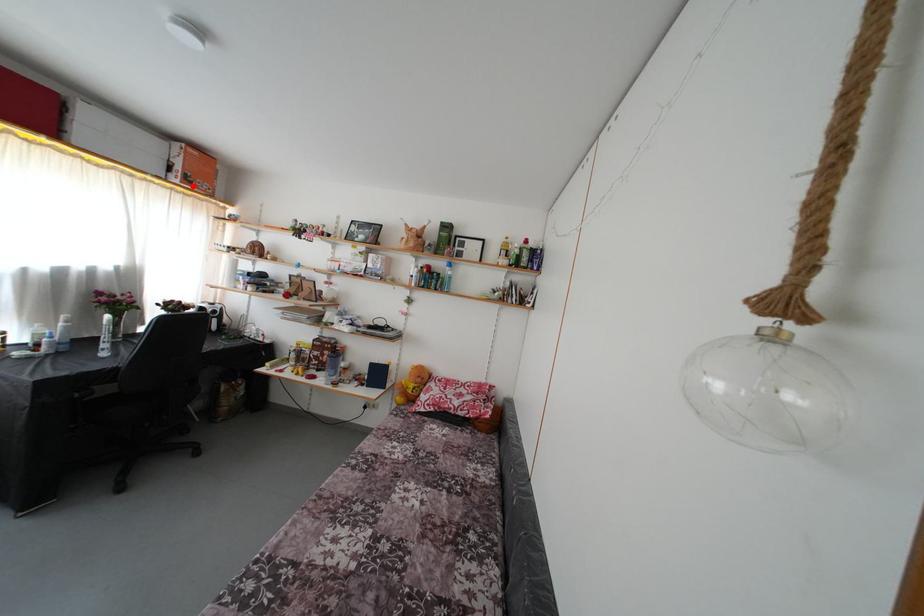
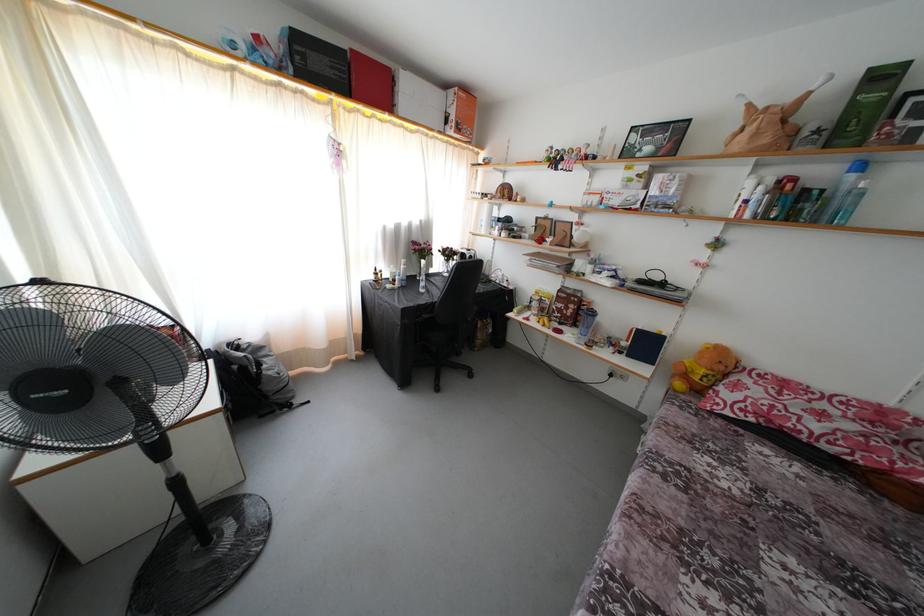
Question: I am providing you with two images of the same scene from different viewpoints. A red point is marked on the first image. Can you still see the location of the red point in image 2?

Choices:
 (A) Yes
 (B) No

Answer: (A)